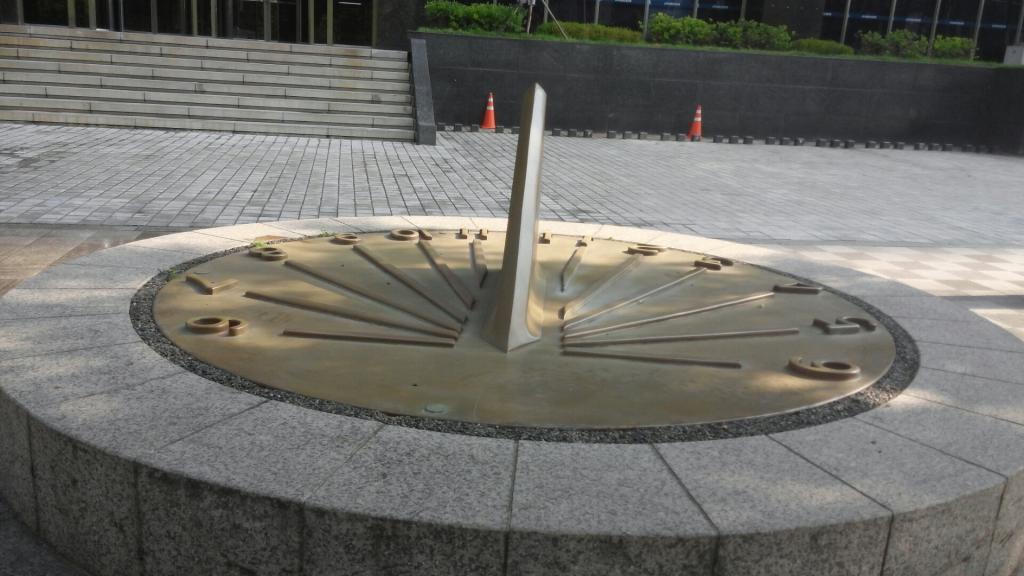
Where is `pedestal`? pedestal is located at coordinates (863, 498).